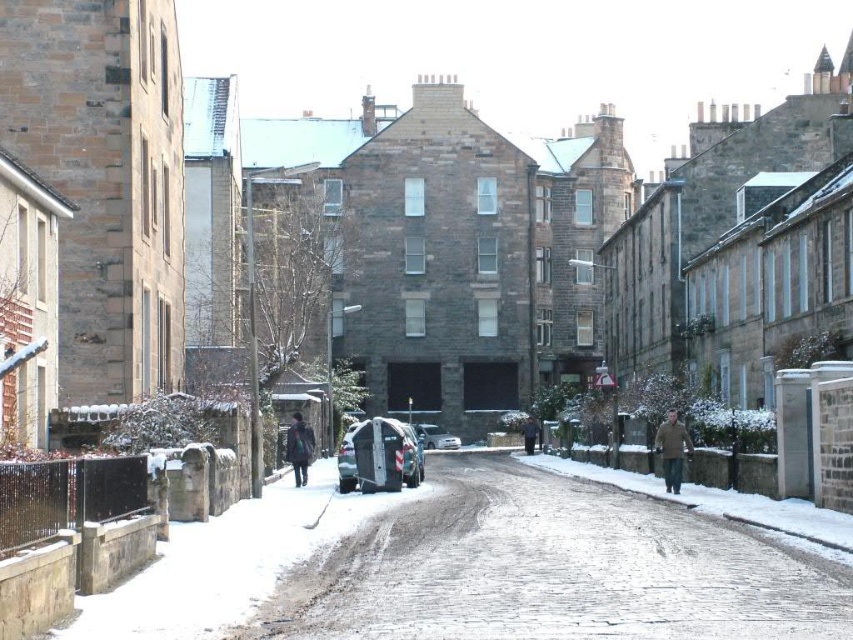
You are standing on the cobblestone street and see a silver metallic car at center and a brown wool coat at center. Which object is positioned more to the left?

The silver metallic car at center is positioned more to the left than the brown wool coat at center.

You are a delivery person carrying a package and need to walk from the snowy cobblestone road at center to the brown wool coat at center. Which direction should you move to reach the coat?

The snowy cobblestone road at center is on the left side of the brown wool coat at center, so you should move to the right to reach the coat.

You are standing at the entrance of the cobblestone street and want to reach the brown wool coat at center. There is a silver metallic car at center blocking your path. What is the minimum distance you need to walk around the car to reach the coat?

The silver metallic car at center is 9.91 meters away from the brown wool coat at center. To reach the coat, you need to walk around the car, so the minimum distance would be approximately 9.91 meters plus the length of the car. However, since the exact length of the car isn